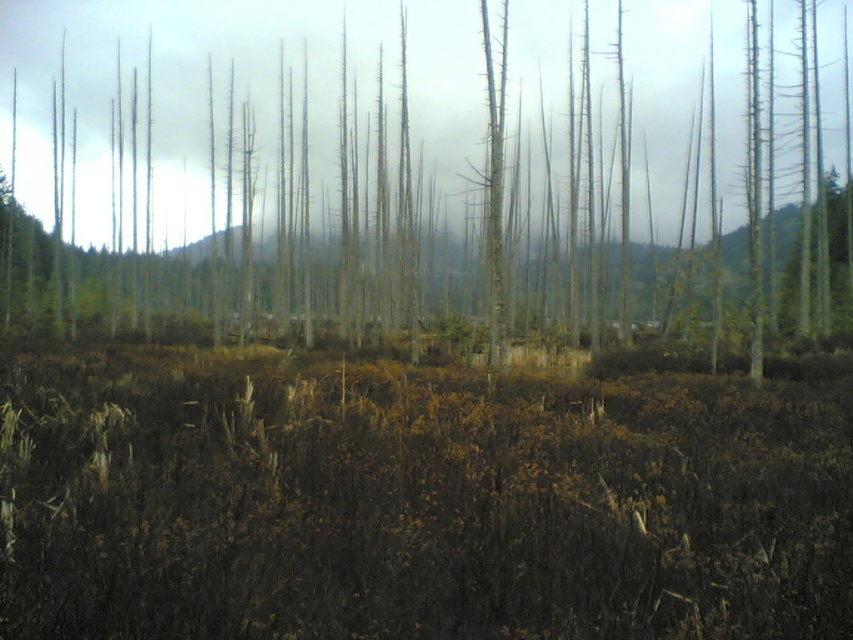
You are a hiker trying to cross through the center of this forest scene. You notice brown dry grass at center and smooth gray tree trunk at center. Which of these two objects is narrower when viewed from above?

The brown dry grass at center is narrower than the smooth gray tree trunk at center when viewed from above, as it has a lesser width compared to the tree trunk.

Imagine you are standing in the desolate forest scene described. You notice two points marked in the image. The first point is located at coordinates point (x=653, y=381), and the second is at point (x=177, y=216). Which of these two points is nearer to you, the observer?

Point (x=653, y=381) is closer to the viewer than point (x=177, y=216).

You are a hiker lost in the forest and see the brown dry grass at center and the smooth gray tree trunk at center. Which object is located to the right side of the other?

The brown dry grass at center is to the right of the smooth gray tree trunk at center.